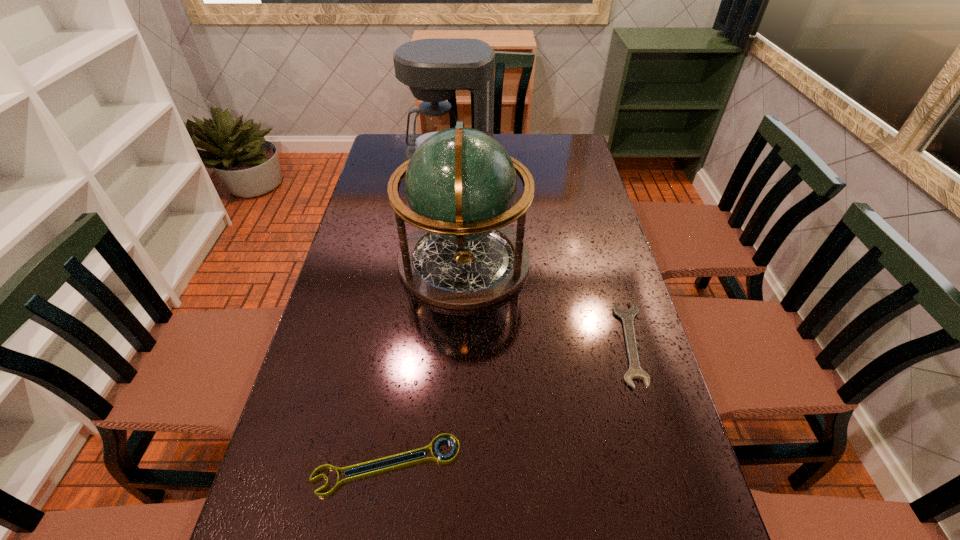
Locate an element on the screen. free spot between the left wrench and the globe is located at coordinates (425, 363).

Locate an element on the screen. This screenshot has width=960, height=540. free space between the rightmost object and the farthest object is located at coordinates (540, 255).

The height and width of the screenshot is (540, 960). I want to click on free spot between the coffee maker and the rightmost object, so (x=540, y=255).

In order to click on blank region between the coffee maker and the farther wrench in this screenshot , I will do `click(540, 255)`.

Locate an element on the screen. vacant area that lies between the coffee maker and the left wrench is located at coordinates (419, 316).

Find the location of a particular element. This screenshot has height=540, width=960. vacant area that lies between the nearer wrench and the coffee maker is located at coordinates pyautogui.click(x=419, y=316).

Where is `free space between the coffee maker and the farther wrench`? Image resolution: width=960 pixels, height=540 pixels. free space between the coffee maker and the farther wrench is located at coordinates (540, 255).

Locate which object is the closest to the nearer wrench. Please provide its 2D coordinates. Your answer should be formatted as a tuple, i.e. [(x, y)], where the tuple contains the x and y coordinates of a point satisfying the conditions above.

[(461, 184)]

Find the location of `object that can be found as the closest to the coffee maker`. object that can be found as the closest to the coffee maker is located at coordinates (461, 184).

Locate an element on the screen. free space that satisfies the following two spatial constraints: 1. on the button side of the coffee maker; 2. on the left side of the farther wrench is located at coordinates (434, 343).